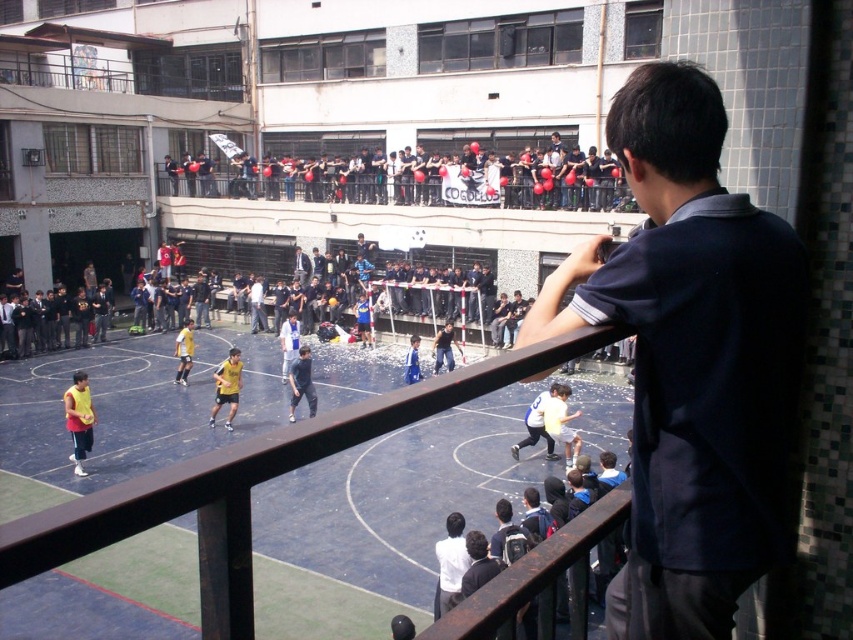
You are a photographer positioned on the balcony. You want to capture a clear shot of the dark blue jersey at center without the black fabric crowd at upper center blocking it. What adjustment should you make to your camera angle?

Lower your camera angle because the black fabric crowd at upper center is taller than the dark blue jersey at center, so lowering the angle would allow you to capture the dark blue jersey at center below the crowd.